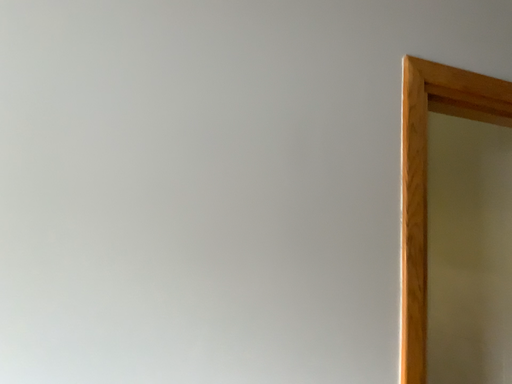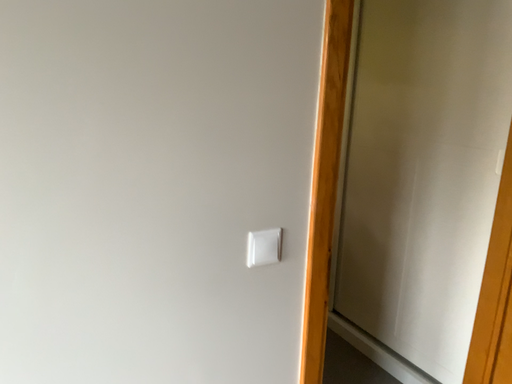
Question: How did the camera likely rotate when shooting the video?

Choices:
 (A) rotated right
 (B) rotated left

Answer: (A)